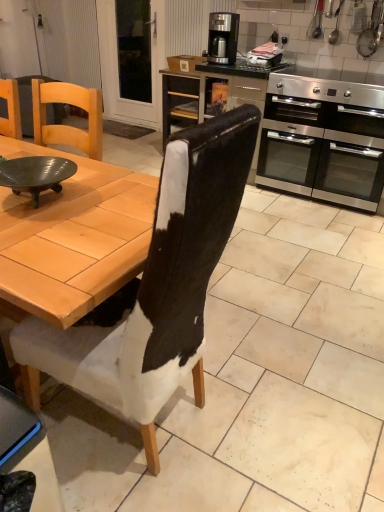
Question: From a real-world perspective, is matte black bowl at left over metallic silver toaster at upper center, the first appliance from the left?

Choices:
 (A) no
 (B) yes

Answer: (A)

Question: Is matte black bowl at left not close to metallic silver toaster at upper center, the first appliance from the left?

Choices:
 (A) yes
 (B) no

Answer: (A)

Question: From a real-world perspective, does matte black bowl at left sit lower than metallic silver toaster at upper center, the 2th appliance in the right-to-left sequence?

Choices:
 (A) no
 (B) yes

Answer: (B)

Question: Is matte black bowl at left closer to camera compared to metallic silver toaster at upper center, the first appliance from the left?

Choices:
 (A) yes
 (B) no

Answer: (A)

Question: Does matte black bowl at left come behind metallic silver toaster at upper center, the 2th appliance in the right-to-left sequence?

Choices:
 (A) yes
 (B) no

Answer: (B)

Question: Is point (56, 167) positioned closer to the camera than point (109, 27)?

Choices:
 (A) closer
 (B) farther

Answer: (A)

Question: From the image's perspective, is matte black bowl at left above or below transparent glass door at upper left?

Choices:
 (A) below
 (B) above

Answer: (A)

Question: Is matte black bowl at left taller or shorter than transparent glass door at upper left?

Choices:
 (A) tall
 (B) short

Answer: (B)

Question: From a real-world perspective, relative to transparent glass door at upper left, is matte black bowl at left vertically above or below?

Choices:
 (A) below
 (B) above

Answer: (B)

Question: Is matte black bowl at left wider or thinner than black leather chair at center?

Choices:
 (A) wide
 (B) thin

Answer: (B)

Question: From the image's perspective, is matte black bowl at left above or below black leather chair at center?

Choices:
 (A) above
 (B) below

Answer: (A)

Question: Considering the relative positions of matte black bowl at left and black leather chair at center in the image provided, is matte black bowl at left to the left or to the right of black leather chair at center?

Choices:
 (A) left
 (B) right

Answer: (A)

Question: In the image, is matte black bowl at left positioned in front of or behind black leather chair at center?

Choices:
 (A) behind
 (B) front

Answer: (A)

Question: In the image, is satin silver coffee maker at upper center positioned in front of or behind metallic silver toaster at upper center, the first appliance from the left?

Choices:
 (A) behind
 (B) front

Answer: (A)

Question: Looking at the image, does satin silver coffee maker at upper center seem bigger or smaller compared to metallic silver toaster at upper center, the 2th appliance in the right-to-left sequence?

Choices:
 (A) big
 (B) small

Answer: (A)